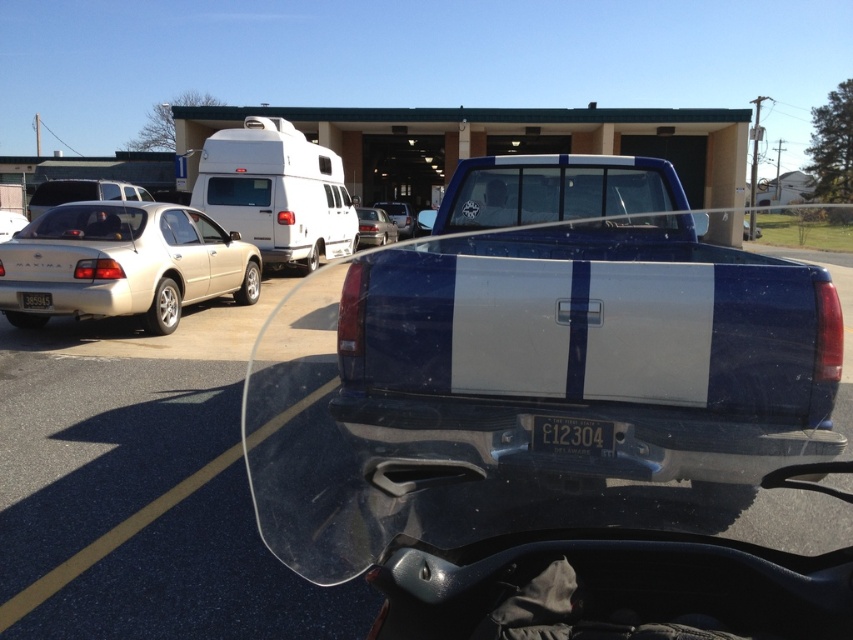
Question: Which point is closer to the camera taking this photo?

Choices:
 (A) (387, 204)
 (B) (376, 208)
 (C) (282, 170)
 (D) (137, 195)

Answer: (C)

Question: Can you confirm if gold metallic sedan at left is positioned to the right of white matte van at upper left?

Choices:
 (A) no
 (B) yes

Answer: (A)

Question: Which of the following is the farthest from the observer?

Choices:
 (A) (387, 208)
 (B) (386, 234)

Answer: (A)

Question: Does satin silver sedan at center have a larger size compared to silver metallic sedan at center?

Choices:
 (A) yes
 (B) no

Answer: (B)

Question: Can you confirm if metallic blue truck at center is positioned below yellow matte license plate at center?

Choices:
 (A) no
 (B) yes

Answer: (A)

Question: Considering the real-world distances, which object is farthest from the silver metallic sedan at center?

Choices:
 (A) yellow matte license plate at center
 (B) satin silver sedan at left
 (C) metallic blue truck at center
 (D) white matte van at upper left

Answer: (A)